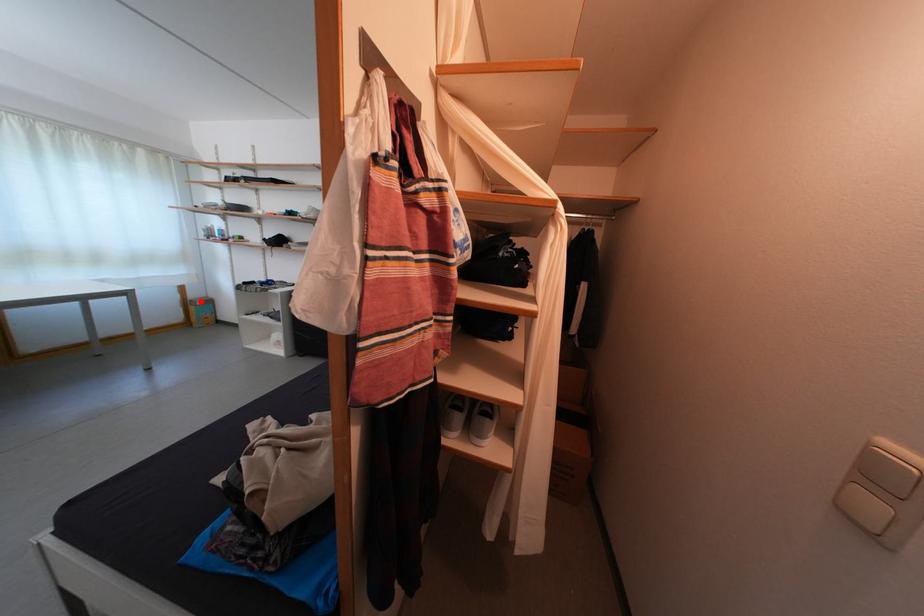
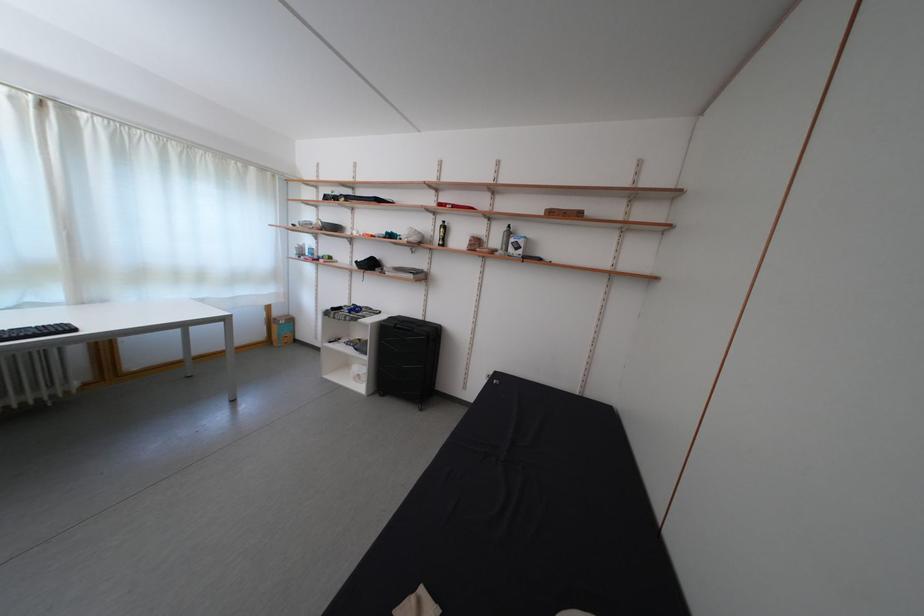
Question: I am providing you with two images of the same scene from different viewpoints. A red point is shown in image1. For the corresponding object point in image2, is it positioned nearer or farther from the camera?

Choices:
 (A) Nearer
 (B) Farther

Answer: (B)